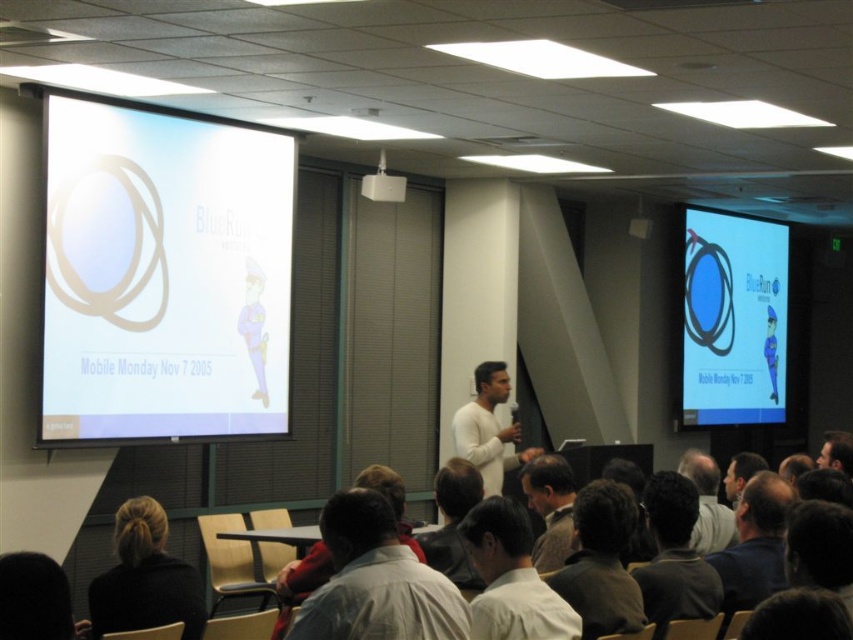
You are an attendee in the conference room and want to describe the presenter to a colleague who hasn t arrived yet. Which object is positioned to the left of the other between the white matte shirt at center and the light brown hair at lower right?

The white matte shirt at center is positioned to the left of the light brown hair at lower right.

You are a presenter in a conference room. You need to display your slides on the white glossy projection screen at upper left. Where exactly should you position yourself to ensure the projector light can reach the screen without obstruction?

The white glossy projection screen at upper left is located at point [164,275]. To project without obstruction, position yourself in a line of sight between the projector and this coordinate.